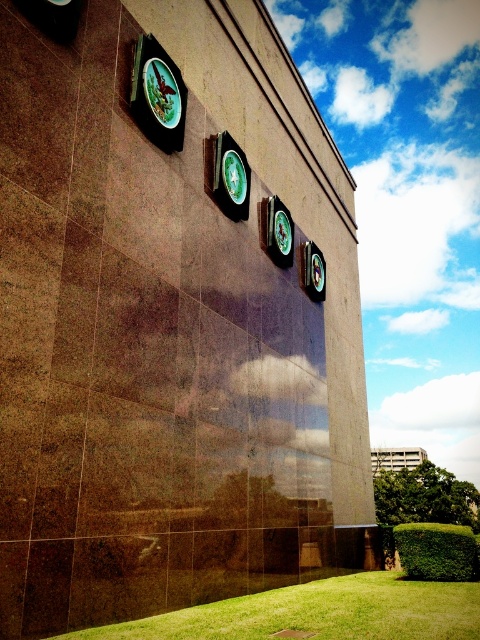
Looking at this image, you are standing in front of the building and notice the green grass at lower center and the green glossy clock at center. Which of these two objects takes up more visual space in the image?

The green glossy clock at center takes up more visual space than the green grass at lower center.

You are standing in front of a building with a wall covered in dark brown tiles. There is a point marked at coordinates (348, 586) on the wall. If you want to touch this point with a 1.8m long pole, can you reach it?

The distance between the point and the camera is 9.61 meters. Since the pole is only 1.8 meters long, you cannot reach the point with it.

You are standing in front of the building and notice the green grass at lower center and the matte green clock at upper left. Which of these two objects appears smaller in size?

The green grass at lower center appears smaller in size compared to the matte green clock at upper left.